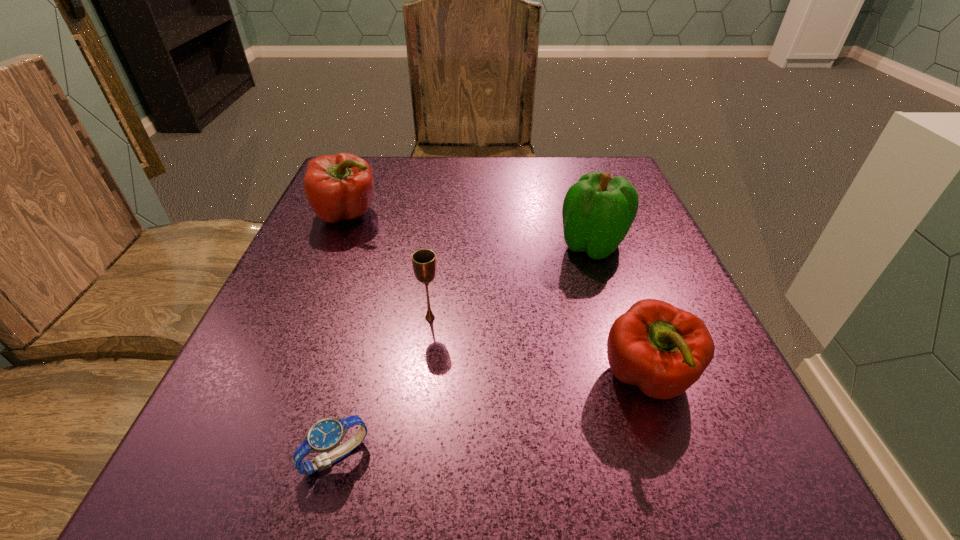
The image size is (960, 540). Identify the location of the leftmost bell pepper. (339, 187).

Image resolution: width=960 pixels, height=540 pixels. Identify the location of the third farthest object. (424, 261).

Locate an element on the screen. The image size is (960, 540). chalice is located at coordinates (424, 261).

Identify the location of the nearest bell pepper. (663, 350).

Identify the location of the nearest object. The height and width of the screenshot is (540, 960). (325, 435).

Find the location of a particular element. watch is located at coordinates (325, 435).

Where is `vacant area situated 0.350m on the front of the leftmost bell pepper`? vacant area situated 0.350m on the front of the leftmost bell pepper is located at coordinates (278, 382).

Locate an element on the screen. Image resolution: width=960 pixels, height=540 pixels. vacant region located on the back of the chalice is located at coordinates (443, 207).

Identify the location of vacant area located 0.120m on the left of the nearest bell pepper. (514, 379).

Identify the location of free space located on the right of the shortest object. This screenshot has height=540, width=960. (451, 456).